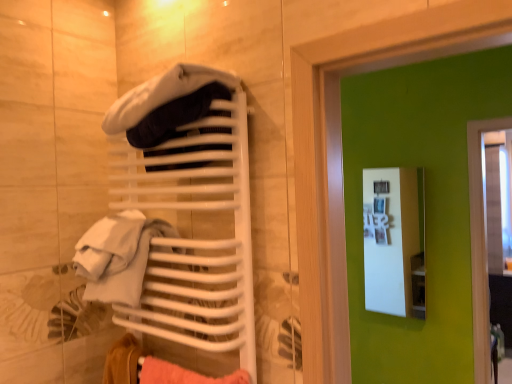
Question: Can you confirm if velvety white hat at upper center is wider than white matte towel rack at upper left?

Choices:
 (A) no
 (B) yes

Answer: (B)

Question: Can white matte towel rack at upper left be found inside velvety white hat at upper center?

Choices:
 (A) no
 (B) yes

Answer: (A)

Question: Is velvety white hat at upper center positioned before white matte towel rack at upper left?

Choices:
 (A) no
 (B) yes

Answer: (B)

Question: Can you see velvety white hat at upper center touching white matte towel rack at upper left?

Choices:
 (A) yes
 (B) no

Answer: (B)

Question: Is velvety white hat at upper center far from white matte towel rack at upper left?

Choices:
 (A) no
 (B) yes

Answer: (A)

Question: Is white glossy medicine cabinet at upper center in front of or behind white matte towel rack at upper left in the image?

Choices:
 (A) behind
 (B) front

Answer: (A)

Question: Is white glossy medicine cabinet at upper center taller or shorter than white matte towel rack at upper left?

Choices:
 (A) short
 (B) tall

Answer: (B)

Question: Which is correct: white glossy medicine cabinet at upper center is inside white matte towel rack at upper left, or outside of it?

Choices:
 (A) outside
 (B) inside

Answer: (A)

Question: Considering the positions of white glossy medicine cabinet at upper center and white matte towel rack at upper left in the image, is white glossy medicine cabinet at upper center wider or thinner than white matte towel rack at upper left?

Choices:
 (A) wide
 (B) thin

Answer: (B)

Question: In terms of height, does white glossy medicine cabinet at upper center look taller or shorter compared to velvety white hat at upper center?

Choices:
 (A) tall
 (B) short

Answer: (A)

Question: Considering their positions, is white glossy medicine cabinet at upper center located in front of or behind velvety white hat at upper center?

Choices:
 (A) front
 (B) behind

Answer: (B)

Question: Considering the positions of white glossy medicine cabinet at upper center and velvety white hat at upper center in the image, is white glossy medicine cabinet at upper center wider or thinner than velvety white hat at upper center?

Choices:
 (A) thin
 (B) wide

Answer: (A)

Question: Is white glossy medicine cabinet at upper center bigger or smaller than velvety white hat at upper center?

Choices:
 (A) small
 (B) big

Answer: (A)

Question: Does point (239, 322) appear closer or farther from the camera than point (415, 190)?

Choices:
 (A) farther
 (B) closer

Answer: (B)

Question: In the image, is white matte towel rack at upper left on the left side or the right side of white glossy medicine cabinet at upper center?

Choices:
 (A) left
 (B) right

Answer: (A)